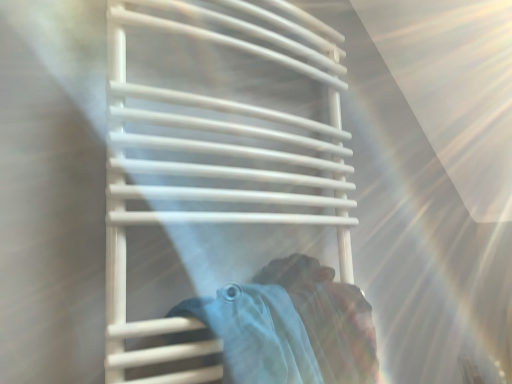
Question: Considering the positions of point (207, 168) and point (224, 357), is point (207, 168) closer or farther from the camera than point (224, 357)?

Choices:
 (A) closer
 (B) farther

Answer: (B)

Question: Considering the positions of white plastic towel rack at center and light blue fabric at center in the image, is white plastic towel rack at center bigger or smaller than light blue fabric at center?

Choices:
 (A) small
 (B) big

Answer: (B)

Question: In terms of width, does white plastic towel rack at center look wider or thinner when compared to light blue fabric at center?

Choices:
 (A) wide
 (B) thin

Answer: (A)

Question: From a real-world perspective, is light blue fabric at center physically located above or below white plastic towel rack at center?

Choices:
 (A) above
 (B) below

Answer: (B)

Question: From the image's perspective, is light blue fabric at center located above or below white plastic towel rack at center?

Choices:
 (A) below
 (B) above

Answer: (A)

Question: Is light blue fabric at center bigger or smaller than white plastic towel rack at center?

Choices:
 (A) small
 (B) big

Answer: (A)

Question: Looking at their shapes, would you say light blue fabric at center is wider or thinner than white plastic towel rack at center?

Choices:
 (A) thin
 (B) wide

Answer: (A)